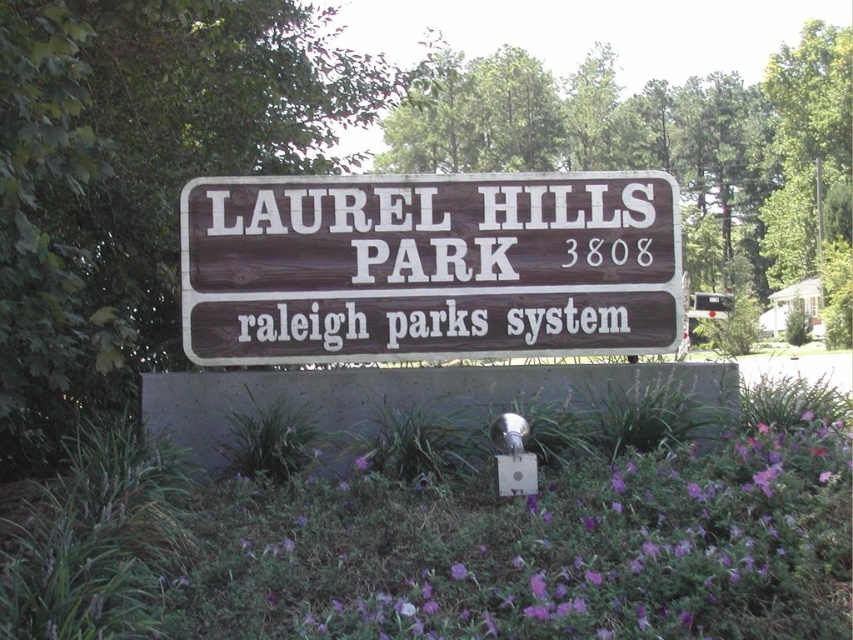
You are standing in front of the Laurel Hills Park sign and notice two points marked on the image. One is at point (506, 278) and the other at point (456, 564). Which point is closer to you?

Point (456, 564) is closer to you because it is less further to the camera than point (506, 278).